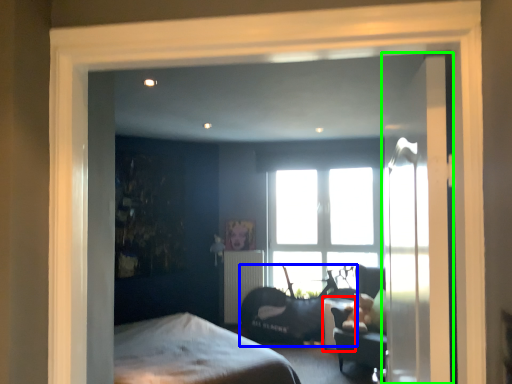
Question: Which is farther away from table (highlighted by a red box)? swivel chair (highlighted by a blue box) or door (highlighted by a green box)?

Choices:
 (A) swivel chair
 (B) door

Answer: (B)